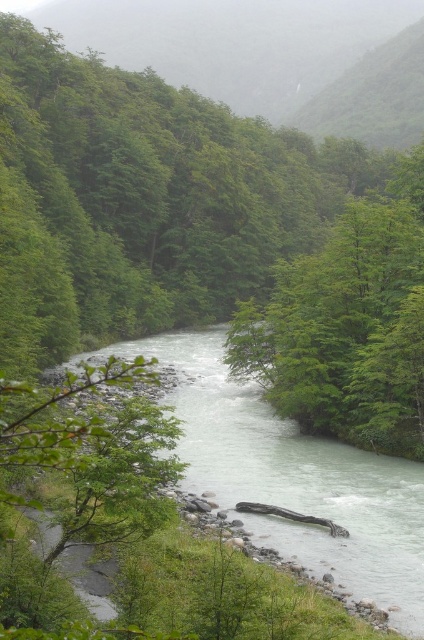
Question: Does green leafy tree at center have a greater width compared to green leafy forest at upper left?

Choices:
 (A) no
 (B) yes

Answer: (A)

Question: Estimate the real-world distances between objects in this image. Which object is farther from the green leafy tree at center?

Choices:
 (A) white smooth river at center
 (B) green leafy forest at upper left

Answer: (B)

Question: Is green leafy forest at upper left above white smooth river at center?

Choices:
 (A) yes
 (B) no

Answer: (A)

Question: Considering the real-world distances, which object is closest to the green leafy tree at center?

Choices:
 (A) green leafy forest at upper left
 (B) white smooth river at center

Answer: (B)

Question: Does green leafy tree at center have a lesser width compared to green leafy forest at upper left?

Choices:
 (A) no
 (B) yes

Answer: (B)

Question: Considering the real-world distances, which object is closest to the white smooth river at center?

Choices:
 (A) green leafy tree at center
 (B) green leafy forest at upper left

Answer: (A)